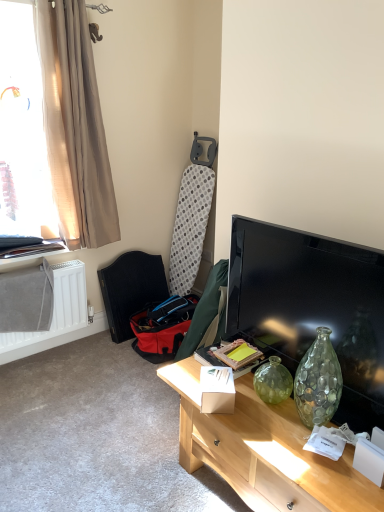
Question: Considering the relative sizes of matte black tv at right and translucent beige curtain at upper left in the image provided, is matte black tv at right taller than translucent beige curtain at upper left?

Choices:
 (A) yes
 (B) no

Answer: (B)

Question: Does matte black tv at right have a lesser width compared to translucent beige curtain at upper left?

Choices:
 (A) no
 (B) yes

Answer: (B)

Question: Can you confirm if matte black tv at right is positioned to the left of translucent beige curtain at upper left?

Choices:
 (A) no
 (B) yes

Answer: (A)

Question: Does matte black tv at right have a smaller size compared to translucent beige curtain at upper left?

Choices:
 (A) no
 (B) yes

Answer: (B)

Question: Considering the relative sizes of matte black tv at right and translucent beige curtain at upper left in the image provided, is matte black tv at right bigger than translucent beige curtain at upper left?

Choices:
 (A) no
 (B) yes

Answer: (A)

Question: Is point (89, 178) positioned closer to the camera than point (61, 296)?

Choices:
 (A) closer
 (B) farther

Answer: (A)

Question: Is beige fabric curtain at left wider or thinner than white matte radiator at lower left?

Choices:
 (A) thin
 (B) wide

Answer: (B)

Question: Would you say beige fabric curtain at left is inside or outside white matte radiator at lower left?

Choices:
 (A) outside
 (B) inside

Answer: (A)

Question: Is beige fabric curtain at left taller or shorter than white matte radiator at lower left?

Choices:
 (A) short
 (B) tall

Answer: (B)

Question: From the image's perspective, is white cardboard box at center located above or below translucent beige curtain at upper left?

Choices:
 (A) below
 (B) above

Answer: (A)

Question: Is white cardboard box at center inside or outside of translucent beige curtain at upper left?

Choices:
 (A) inside
 (B) outside

Answer: (B)

Question: Is white cardboard box at center wider or thinner than translucent beige curtain at upper left?

Choices:
 (A) wide
 (B) thin

Answer: (B)

Question: Relative to translucent beige curtain at upper left, is white cardboard box at center in front or behind?

Choices:
 (A) front
 (B) behind

Answer: (A)

Question: In the image, is light wood desk at center positioned in front of or behind dark brown leather armchair at lower left?

Choices:
 (A) behind
 (B) front

Answer: (B)

Question: From a real-world perspective, relative to dark brown leather armchair at lower left, is light wood desk at center vertically above or below?

Choices:
 (A) below
 (B) above

Answer: (A)